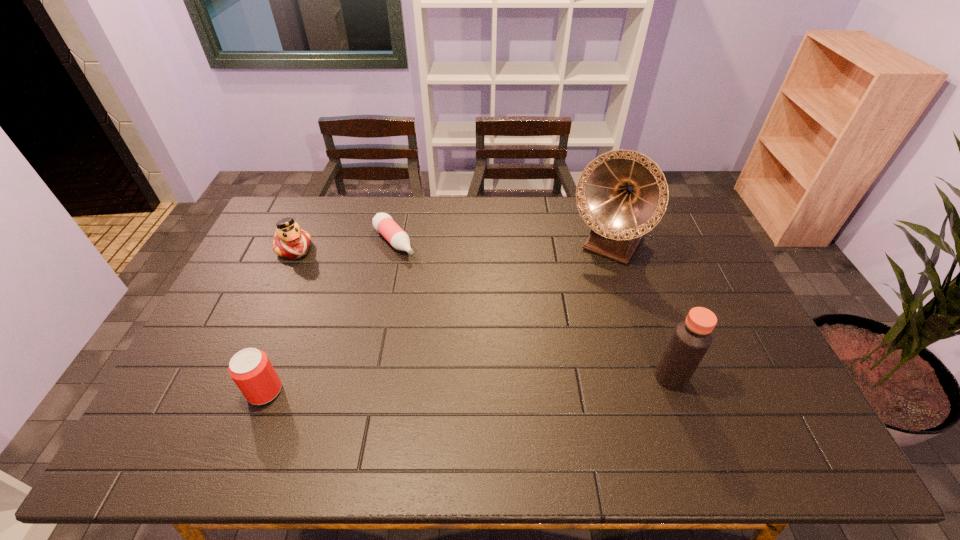
Locate an element on the screen. Image resolution: width=960 pixels, height=540 pixels. beer can present at the near edge is located at coordinates (251, 370).

What are the coordinates of `vinegar that is positioned at the near edge` in the screenshot? It's located at (691, 339).

At what (x,y) coordinates should I click in order to perform the action: click on object that is at the left edge. Please return your answer as a coordinate pair (x, y). The width and height of the screenshot is (960, 540). Looking at the image, I should click on (290, 241).

The image size is (960, 540). Identify the location of object located at the far left corner. (290, 241).

The height and width of the screenshot is (540, 960). I want to click on vacant space at the far edge, so click(x=420, y=203).

In the image, there is a desktop. What are the coordinates of `free space at the near edge` in the screenshot? It's located at (279, 407).

In the image, there is a desktop. Where is `vacant space at the right edge`? The width and height of the screenshot is (960, 540). vacant space at the right edge is located at coordinates (731, 307).

In the image, there is a desktop. Where is `vacant space at the near left corner`? The height and width of the screenshot is (540, 960). vacant space at the near left corner is located at coordinates pos(178,386).

The image size is (960, 540). I want to click on vacant region at the far right corner, so click(681, 237).

At what (x,y) coordinates should I click in order to perform the action: click on unoccupied area between the duck and the third object from left to right. Please return your answer as a coordinate pair (x, y). Image resolution: width=960 pixels, height=540 pixels. Looking at the image, I should click on (345, 246).